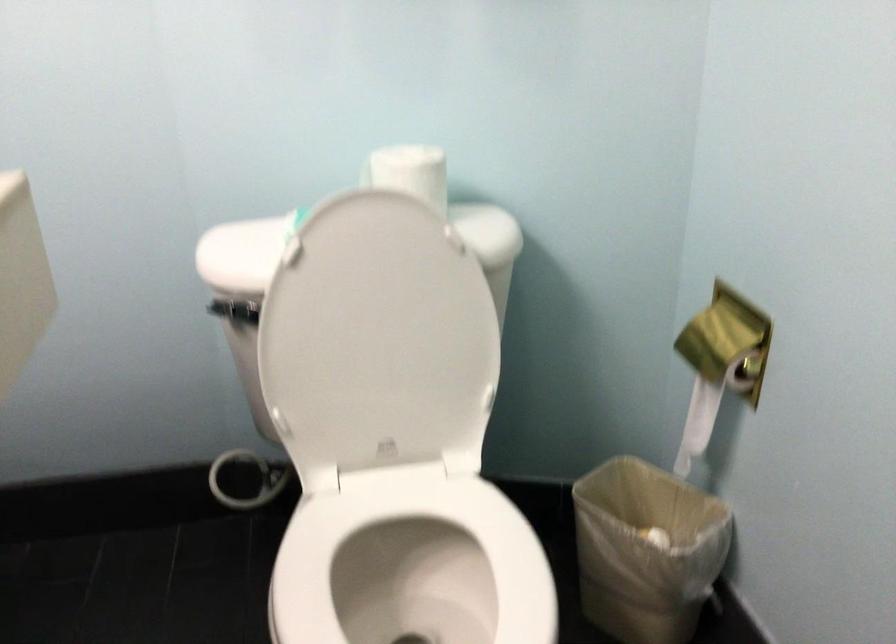
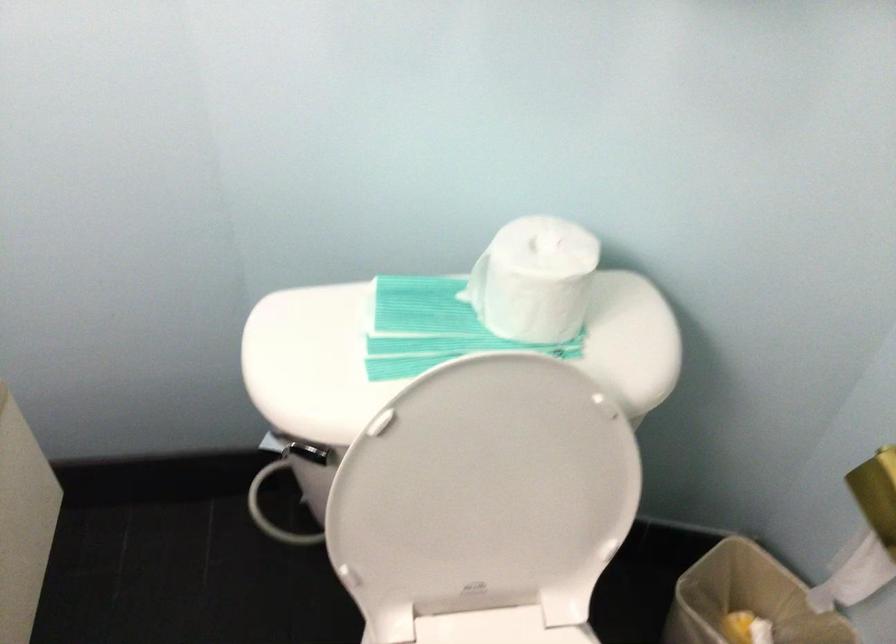
The point at (694, 381) is marked in the first image. Where is the corresponding point in the second image?

(866, 534)